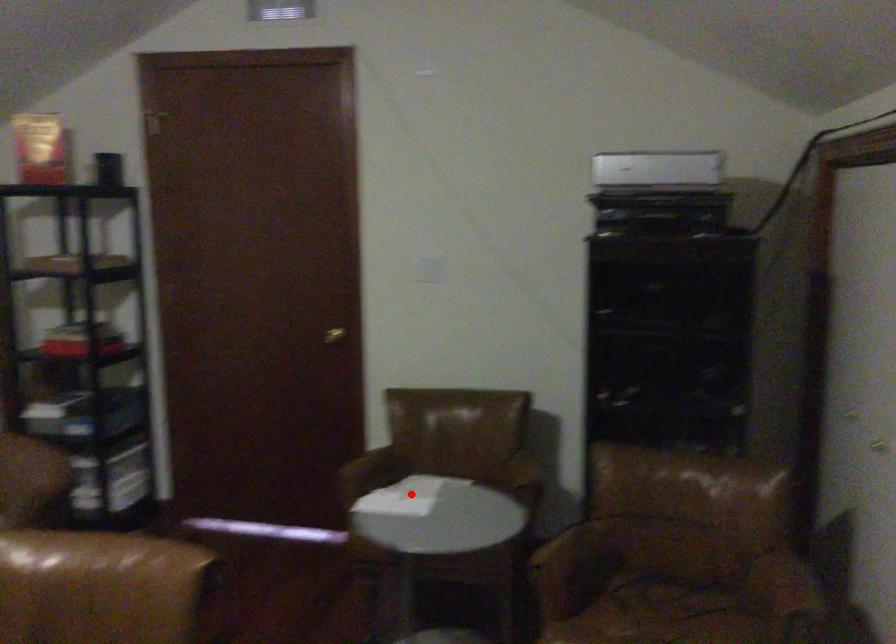
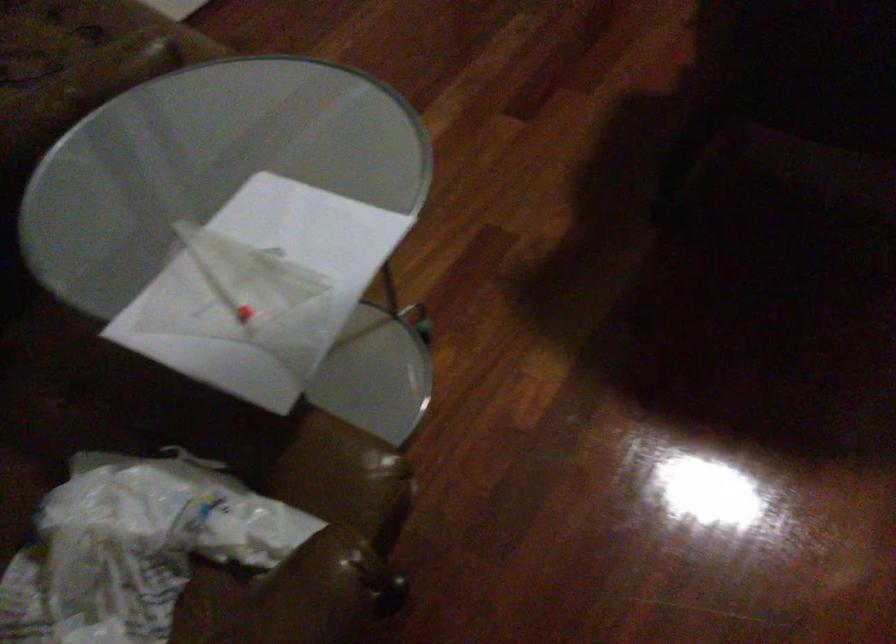
Where in the second image is the point corresponding to the highlighted location from the first image?

(134, 547)